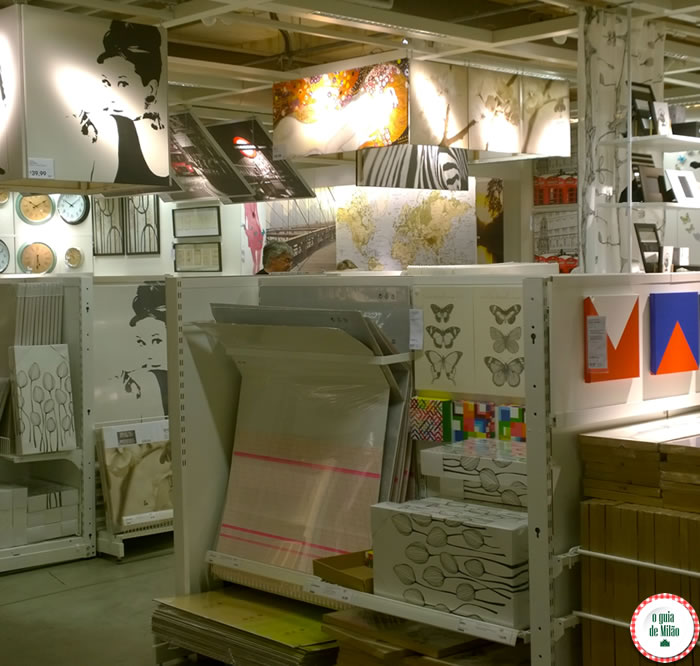
Where is `tile floor`? Image resolution: width=700 pixels, height=666 pixels. tile floor is located at coordinates (91, 587), (140, 587).